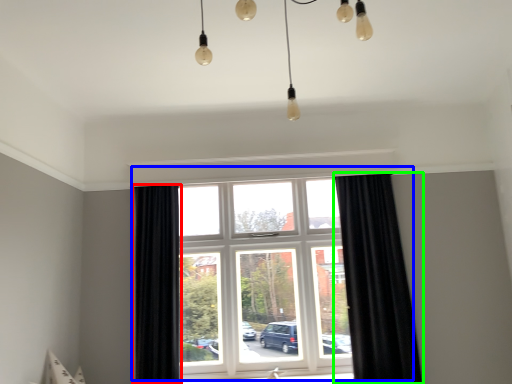
Question: Based on their relative distances, which object is farther from curtain (highlighted by a red box)? Choose from window (highlighted by a blue box) and curtain (highlighted by a green box).

Choices:
 (A) window
 (B) curtain

Answer: (B)